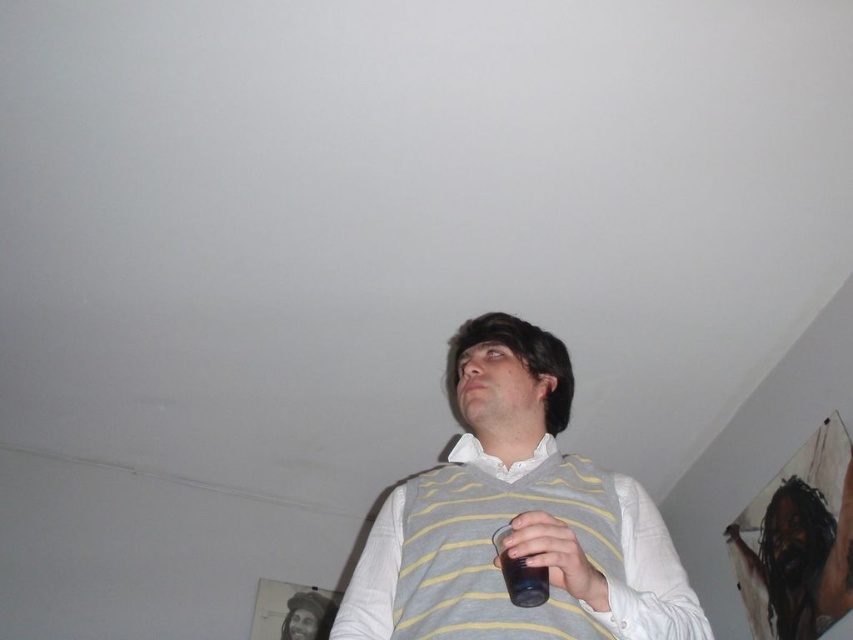
From the picture: Is gray striped sweater at center wider than matte black cup at lower center?

In fact, gray striped sweater at center might be narrower than matte black cup at lower center.

Is point (773, 628) less distant than point (541, 556)?

No, it is behind (541, 556).

Does point (786, 579) come behind point (596, 586)?

Yes, point (786, 579) is farther from viewer.

Image resolution: width=853 pixels, height=640 pixels. I want to click on gray striped sweater at center, so click(x=796, y=561).

Which of these two, yellow striped sweater vest at center or matte black cup at lower center, stands taller?

yellow striped sweater vest at center is taller.

Does yellow striped sweater vest at center have a lesser height compared to matte black cup at lower center?

Incorrect, yellow striped sweater vest at center's height does not fall short of matte black cup at lower center's.

The height and width of the screenshot is (640, 853). Find the location of `yellow striped sweater vest at center`. yellow striped sweater vest at center is located at coordinates (515, 518).

Identify the location of yellow striped sweater vest at center. The height and width of the screenshot is (640, 853). (515, 518).

Is yellow striped sweater vest at center taller than gray striped sweater at center?

No, yellow striped sweater vest at center is not taller than gray striped sweater at center.

Does yellow striped sweater vest at center appear on the left side of gray striped sweater at center?

Indeed, yellow striped sweater vest at center is positioned on the left side of gray striped sweater at center.

What do you see at coordinates (515, 518) in the screenshot? The height and width of the screenshot is (640, 853). I see `yellow striped sweater vest at center` at bounding box center [515, 518].

The image size is (853, 640). Find the location of `yellow striped sweater vest at center`. yellow striped sweater vest at center is located at coordinates (515, 518).